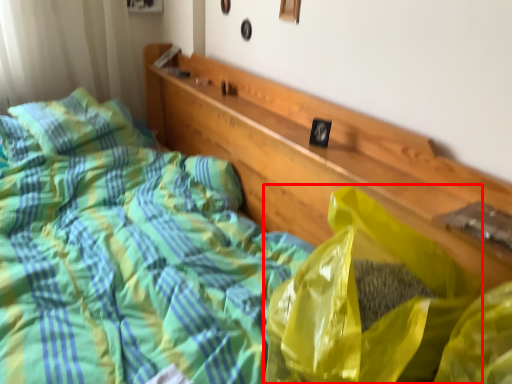
Question: Where is plastic bag (annotated by the red box) located in relation to pillow in the image?

Choices:
 (A) right
 (B) left

Answer: (A)